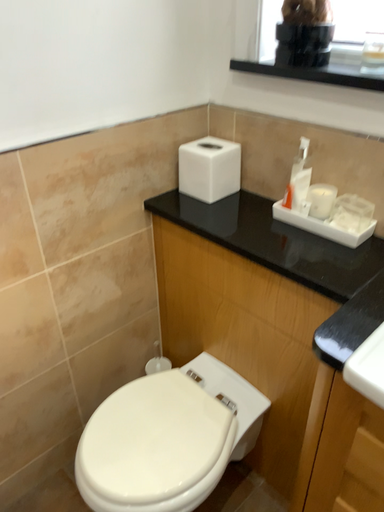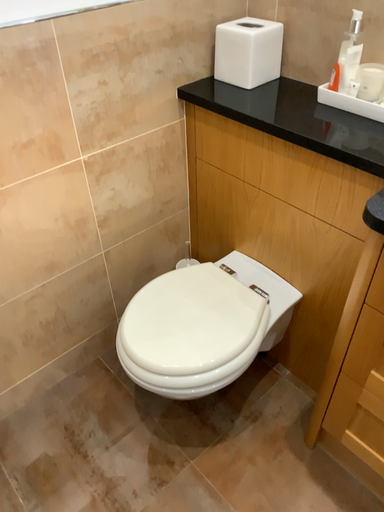
Question: How did the camera likely rotate when shooting the video?

Choices:
 (A) rotated upward
 (B) rotated downward

Answer: (B)